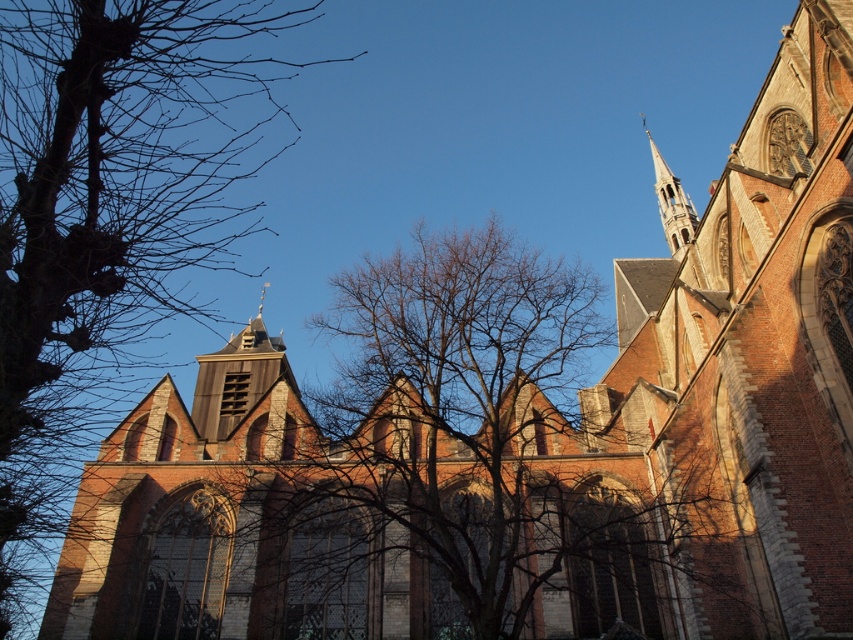
Is point (236, 120) closer to camera compared to point (339, 372)?

No, (236, 120) is further to viewer.

Is bare branches at left wider than bare branches at center?

In fact, bare branches at left might be narrower than bare branches at center.

Where is `bare branches at left`? bare branches at left is located at coordinates (x=107, y=221).

At what (x,y) coordinates should I click in order to perform the action: click on bare branches at left. Please return your answer as a coordinate pair (x, y). Looking at the image, I should click on (107, 221).

Who is higher up, bare branches at center or smooth gray steeple at upper right?

smooth gray steeple at upper right is above.

Which of these two, bare branches at center or smooth gray steeple at upper right, stands shorter?

With less height is bare branches at center.

Is point (341, 332) positioned before point (676, 188)?

No, (341, 332) is further to viewer.

The image size is (853, 640). Find the location of `bare branches at center`. bare branches at center is located at coordinates (457, 323).

Is point (126, 291) behind point (671, 246)?

That is False.

You are a GUI agent. You are given a task and a screenshot of the screen. Output one action in this format:
    pyautogui.click(x=<x>, y=<y>)
    Task: Click on the bare branches at left
    
    Given the screenshot: What is the action you would take?
    pyautogui.click(x=107, y=221)

Is point (27, 220) positioned after point (682, 195)?

No, it is in front of (682, 195).

Find the location of a particular element. The width and height of the screenshot is (853, 640). bare branches at left is located at coordinates (107, 221).